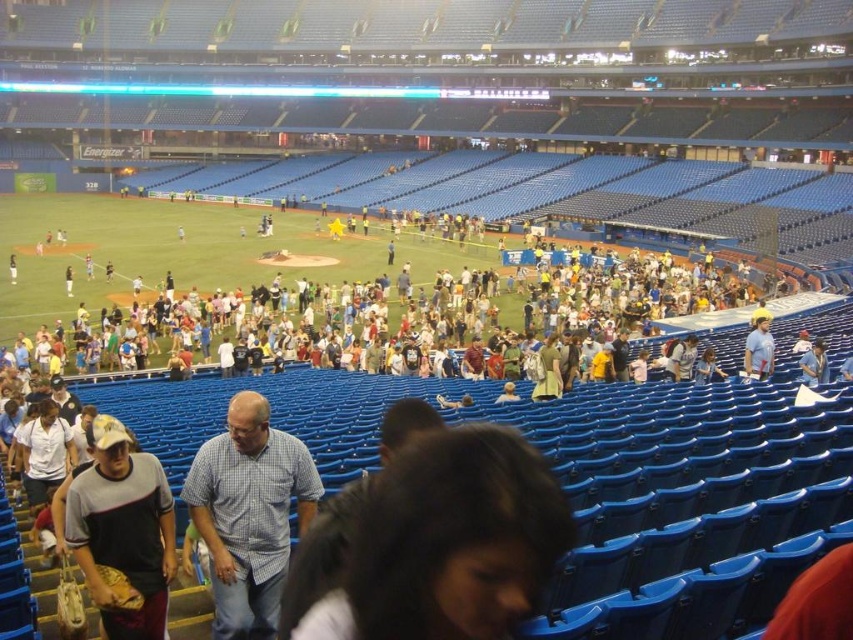
You are a photographer standing at the back of the stadium. You want to take a photo that includes both the checkered fabric shirt at center and the light blue shirt at right. Which of the two shirts should you adjust your camera angle to focus on first to ensure both are in the frame?

You should focus on the checkered fabric shirt at center first since it is in front of the light blue shirt at right. By centering your shot on the checkered shirt, you can adjust the angle to include the light blue shirt behind it while keeping both visible in the frame.